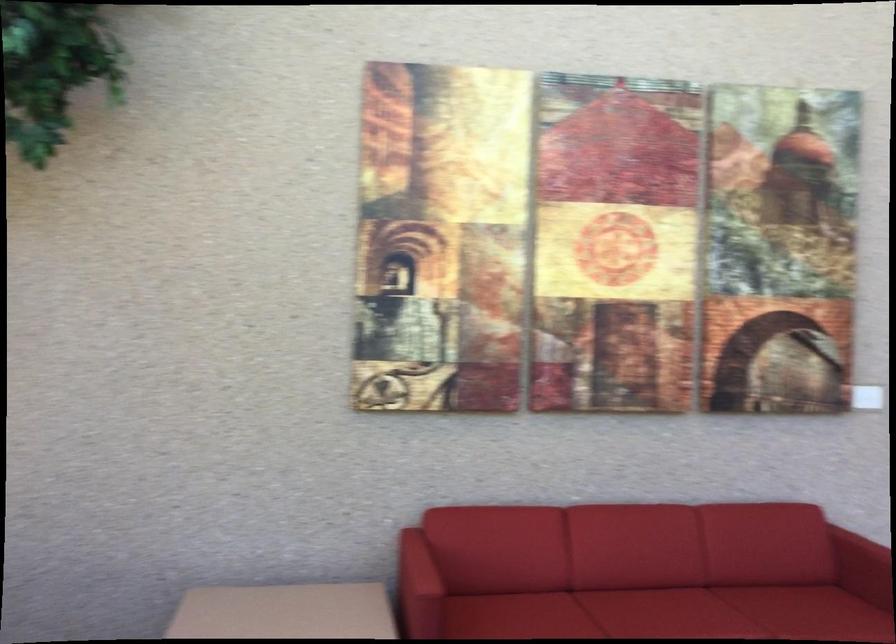
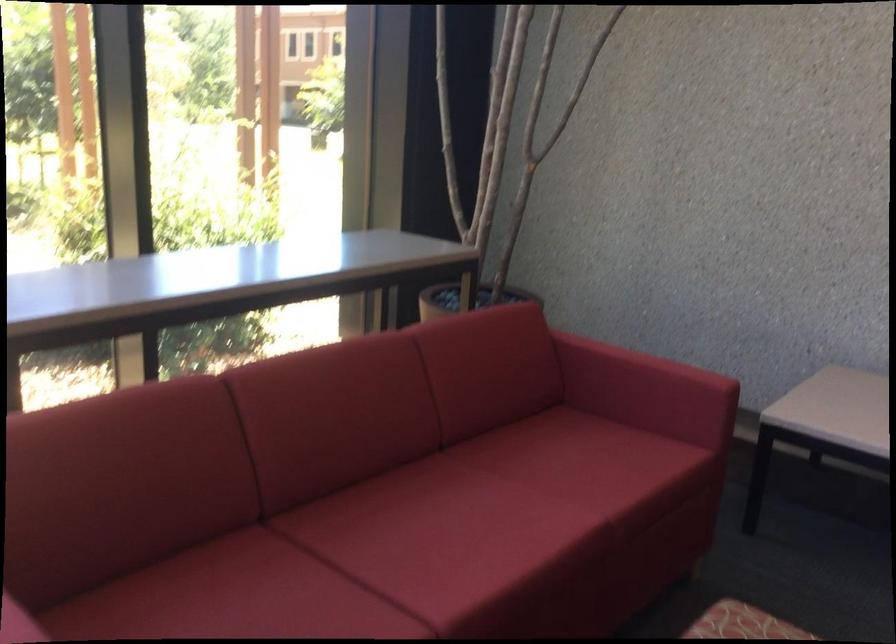
Based on the continuous images, in which direction is the camera rotating?

The rotation direction of the camera is left-down.